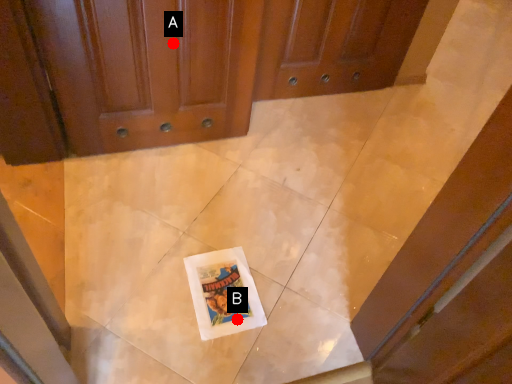
Question: Two points are circled on the image, labeled by A and B beside each circle. Which point is farther to the camera?

Choices:
 (A) A is further
 (B) B is further

Answer: (A)